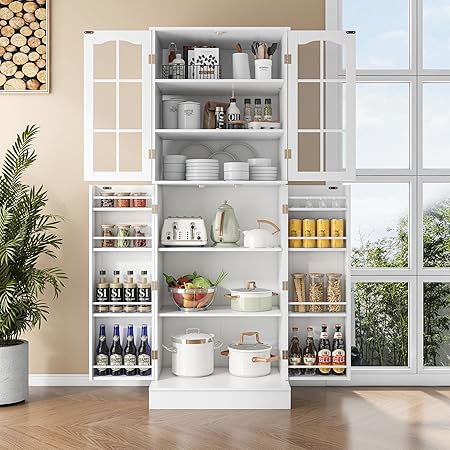
You are a GUI agent. You are given a task and a screenshot of the screen. Output one action in this format:
    pyautogui.click(x=<x>, y=<y>)
    Task: Click on the glass container
    The image size is (450, 450).
    Given the screenshot: What is the action you would take?
    pyautogui.click(x=106, y=198), pyautogui.click(x=122, y=196), pyautogui.click(x=139, y=202), pyautogui.click(x=108, y=232), pyautogui.click(x=125, y=236), pyautogui.click(x=139, y=239), pyautogui.click(x=300, y=291), pyautogui.click(x=314, y=292), pyautogui.click(x=328, y=295)